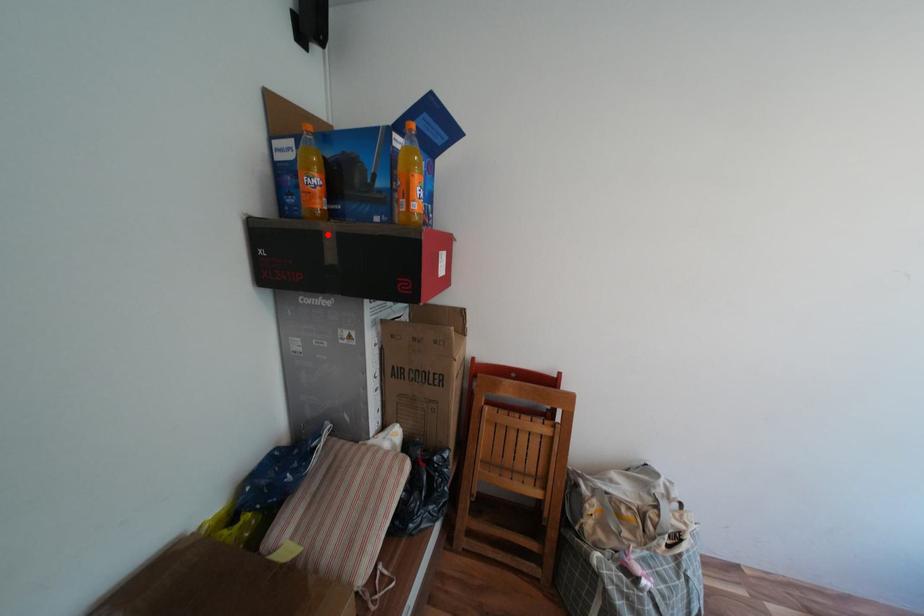
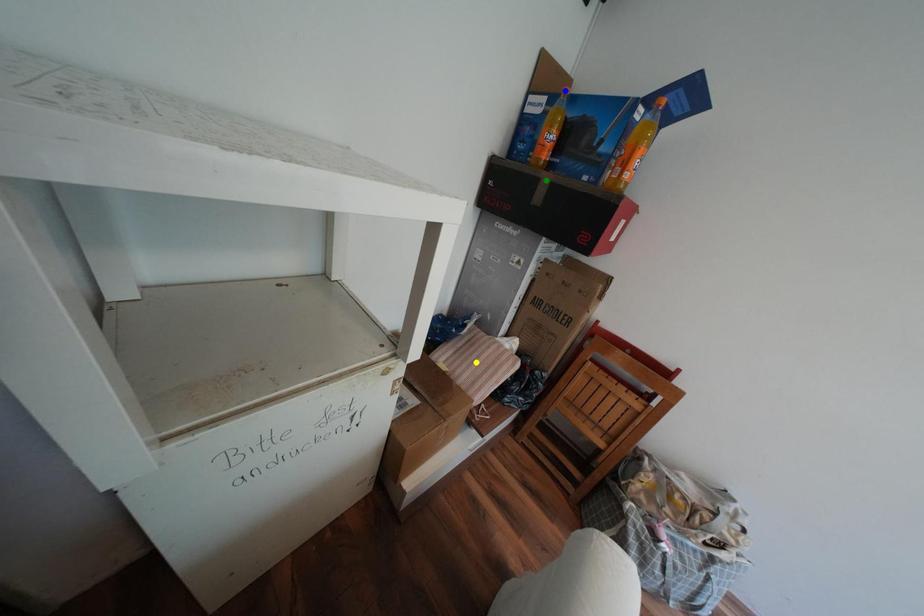
Question: I am providing you with two images of the same scene from different viewpoints. A red point is marked on the first image. You are given multiple points on the second image. Which point in image 2 represents the same 3d spot as the red point in image 1?

Choices:
 (A) green point
 (B) blue point
 (C) yellow point

Answer: (A)